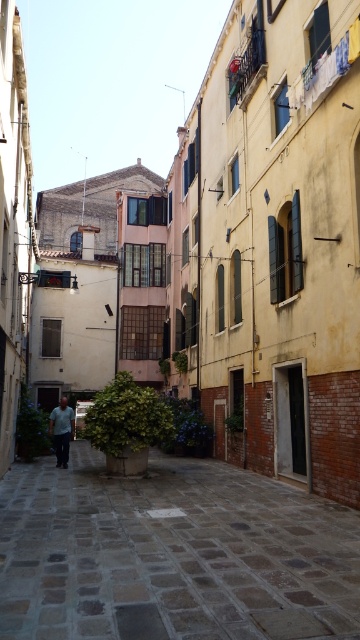
In the scene shown: Which is more to the left, stone paved path at center or light green shirt at center?

From the viewer's perspective, light green shirt at center appears more on the left side.

Is stone paved path at center to the left of light green shirt at center from the viewer's perspective?

Incorrect, stone paved path at center is not on the left side of light green shirt at center.

Locate an element on the screen. The height and width of the screenshot is (640, 360). stone paved path at center is located at coordinates [x=172, y=554].